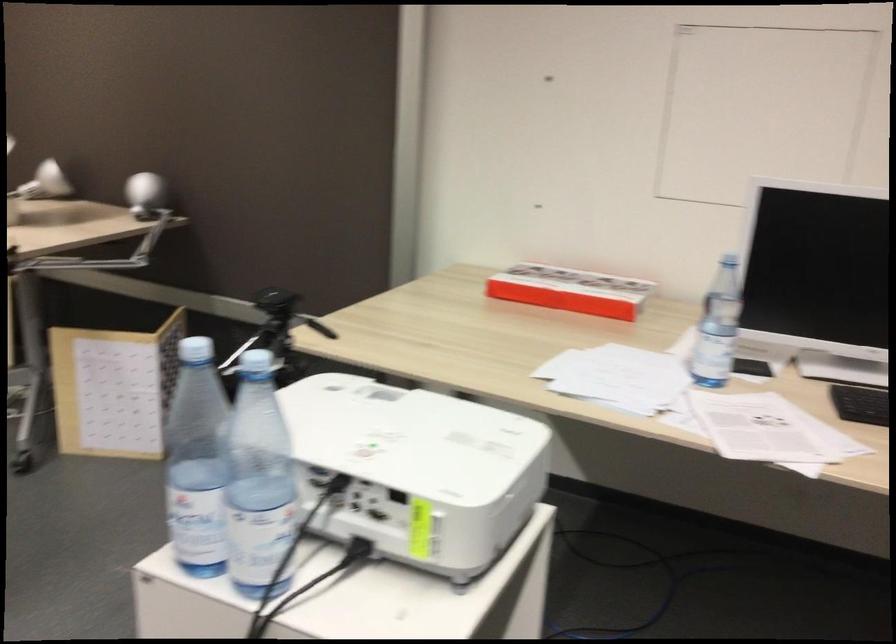
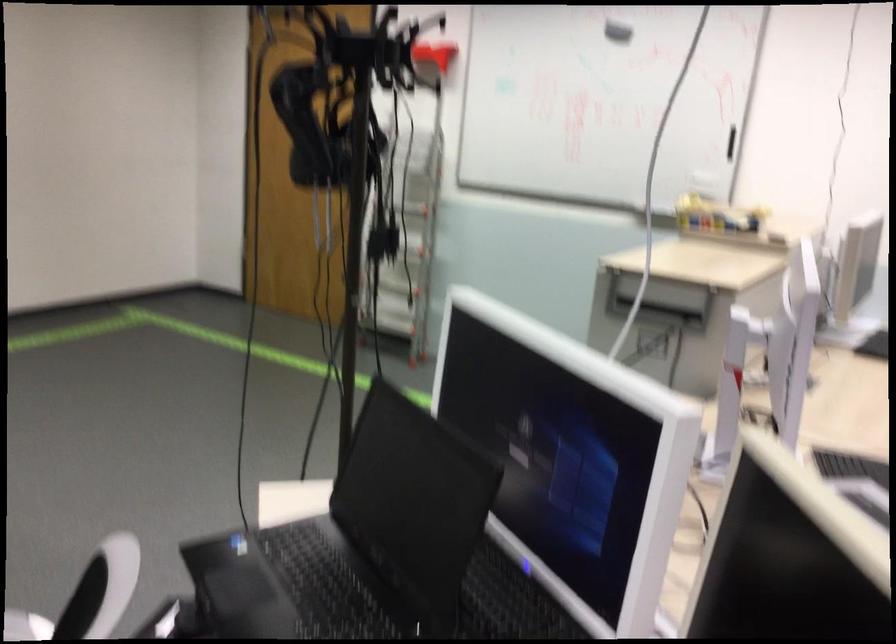
How did the camera likely rotate?

The camera's rotation is toward left-down.